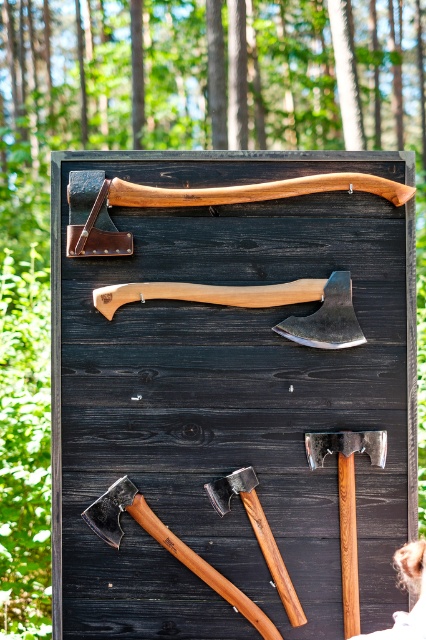
Question: Which object is farther from the camera taking this photo?

Choices:
 (A) wooden handle at top
 (B) polished wood hammer at lower center
 (C) wooden axe at lower right

Answer: (B)

Question: Does wooden axe at upper center have a lesser width compared to wooden axe at lower right?

Choices:
 (A) no
 (B) yes

Answer: (A)

Question: Can you confirm if wooden handle at top is bigger than wooden axe at upper center?

Choices:
 (A) no
 (B) yes

Answer: (B)

Question: Which point appears closest to the camera in this image?

Choices:
 (A) (74, 252)
 (B) (252, 300)

Answer: (B)

Question: Which object is the closest to the wooden handle axe at center?

Choices:
 (A) wooden axe at lower right
 (B) wooden handle at top
 (C) polished wood hammer at lower center
 (D) wooden handle axe at lower center

Answer: (B)

Question: Observing the image, what is the correct spatial positioning of wooden handle at top in reference to wooden axe at lower right?

Choices:
 (A) above
 (B) below

Answer: (A)